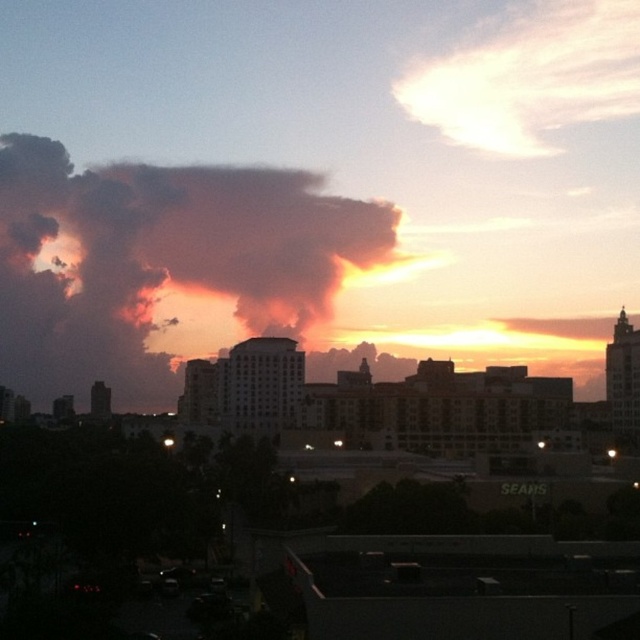
Question: Does dark orange smoke at upper left have a larger size compared to pastel pink cotton cloud at upper right?

Choices:
 (A) no
 (B) yes

Answer: (B)

Question: Can you confirm if dark orange smoke at upper left is positioned to the right of pastel pink cotton cloud at upper right?

Choices:
 (A) yes
 (B) no

Answer: (B)

Question: Does dark orange smoke at upper left have a larger size compared to pastel pink cotton cloud at upper right?

Choices:
 (A) yes
 (B) no

Answer: (A)

Question: Which of the following is the farthest from the observer?

Choices:
 (A) (528, 12)
 (B) (156, 401)

Answer: (A)

Question: Which object is farther from the camera taking this photo?

Choices:
 (A) pastel pink cotton cloud at upper right
 (B) dark orange smoke at upper left

Answer: (A)